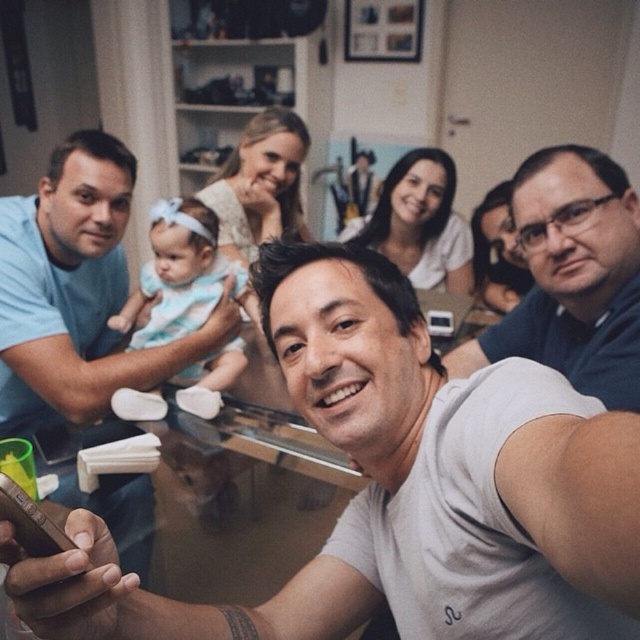
You are a photographer trying to capture a clear shot of the light blue fabric baby at center without the dark blue shirt at right blocking the view. Can you adjust your position to achieve this?

The dark blue shirt at right is in front of the light blue fabric baby at center, so moving your position to the left side might allow you to see the light blue fabric baby at center without obstruction.

You are a photographer trying to capture a clear photo of the light blue fabric baby at left and the light blue fabric baby at center. Which baby will appear closer to the camera in the photo?

The light blue fabric baby at left will appear closer to the camera in the photo because it is positioned in front of the light blue fabric baby at center.

You are a photographer standing at the camera position. You want to take a closeup shot of the light blue fabric baby at left without moving the camera. Is the baby within your camera lens range if the minimum focusing distance is 1.5 meters?

The light blue fabric baby at left is 1.28 meters away from the camera, which is within the minimum focusing distance of 1.5 meters. Therefore, the camera can focus on the baby without needing to move.